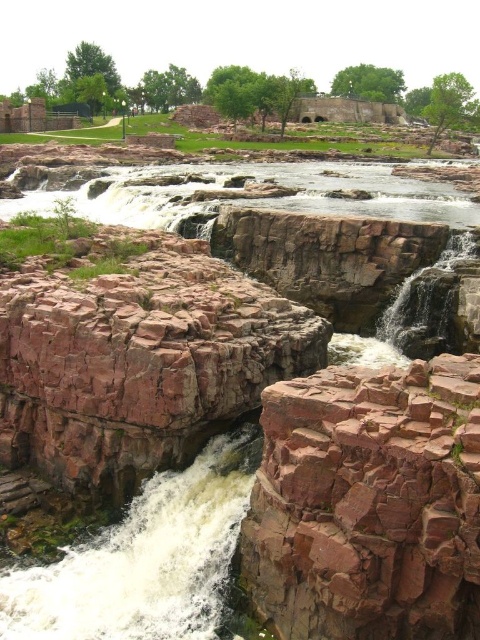
Does rusty stone bridge at center appear on the right side of white frothy water at center?

Indeed, rusty stone bridge at center is positioned on the right side of white frothy water at center.

Is point (275, 412) closer to viewer compared to point (332, 164)?

Yes, it is.

Locate an element on the screen. The height and width of the screenshot is (640, 480). rusty stone bridge at center is located at coordinates (369, 502).

Does point (303, 566) come behind point (167, 483)?

No.

Who is shorter, rusty stone bridge at center or brown rock waterfall at lower left?

With less height is brown rock waterfall at lower left.

You are a GUI agent. You are given a task and a screenshot of the screen. Output one action in this format:
    pyautogui.click(x=<x>, y=<y>)
    Task: Click on the rusty stone bridge at center
    Image resolution: width=480 pixels, height=640 pixels.
    Given the screenshot: What is the action you would take?
    pyautogui.click(x=369, y=502)

Find the location of a particular element. The image size is (480, 640). rusty stone bridge at center is located at coordinates (369, 502).

Does brown rock waterfall at lower left have a greater height compared to white frothy water at center?

No, brown rock waterfall at lower left is not taller than white frothy water at center.

Does point (113, 573) come behind point (354, 182)?

No, (113, 573) is closer to viewer.

Who is more forward, (36, 592) or (84, 212)?

Point (36, 592)

Locate an element on the screen. Image resolution: width=480 pixels, height=640 pixels. brown rock waterfall at lower left is located at coordinates [x=145, y=557].